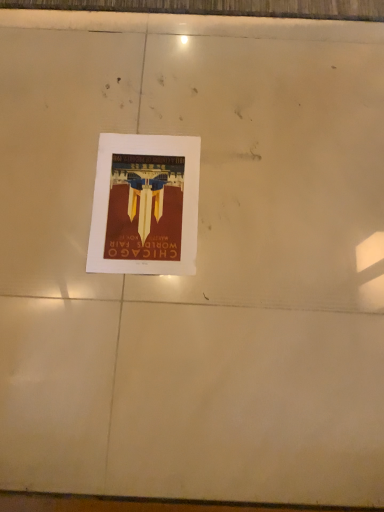
What do you see at coordinates (145, 205) in the screenshot? The width and height of the screenshot is (384, 512). I see `maroon paper poster at center` at bounding box center [145, 205].

Locate an element on the screen. maroon paper poster at center is located at coordinates (145, 205).

The width and height of the screenshot is (384, 512). Identify the location of maroon paper poster at center. (145, 205).